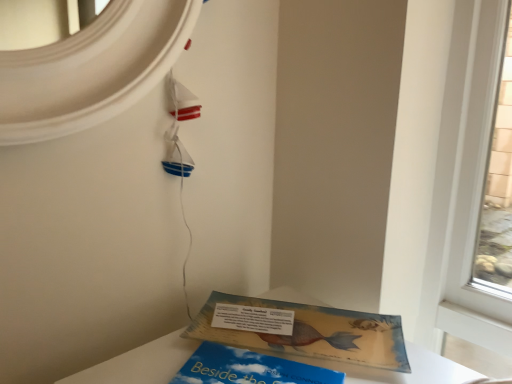
Question: Is blue matte book at lower center, marked as the 1th book in a front-to-back arrangement, at the left side of white paper at lower center?

Choices:
 (A) no
 (B) yes

Answer: (B)

Question: Is blue matte book at lower center, acting as the 2th book starting from the back, further to camera compared to white paper at lower center?

Choices:
 (A) no
 (B) yes

Answer: (A)

Question: From a real-world perspective, is blue matte book at lower center, marked as the 1th book in a front-to-back arrangement, below white paper at lower center?

Choices:
 (A) no
 (B) yes

Answer: (B)

Question: Is blue matte book at lower center, marked as the 1th book in a front-to-back arrangement, positioned in front of white paper at lower center?

Choices:
 (A) no
 (B) yes

Answer: (B)

Question: Is blue matte book at lower center, acting as the 2th book starting from the back, thinner than white paper at lower center?

Choices:
 (A) yes
 (B) no

Answer: (B)

Question: Is point (256, 317) closer or farther from the camera than point (232, 355)?

Choices:
 (A) closer
 (B) farther

Answer: (B)

Question: Is white paper at lower center situated inside blue matte book at lower center, marked as the 1th book in a front-to-back arrangement, or outside?

Choices:
 (A) outside
 (B) inside

Answer: (A)

Question: From the image's perspective, relative to blue matte book at lower center, marked as the 1th book in a front-to-back arrangement, is white paper at lower center above or below?

Choices:
 (A) below
 (B) above

Answer: (B)

Question: Visually, is white paper at lower center positioned to the left or to the right of blue matte book at lower center, acting as the 2th book starting from the back?

Choices:
 (A) right
 (B) left

Answer: (A)

Question: From a real-world perspective, is matte yellow book at lower center, the second book viewed from the front, physically located above or below blue matte book at lower center, marked as the 1th book in a front-to-back arrangement?

Choices:
 (A) above
 (B) below

Answer: (A)

Question: Considering the positions of point (198, 317) and point (214, 374), is point (198, 317) closer or farther from the camera than point (214, 374)?

Choices:
 (A) farther
 (B) closer

Answer: (A)

Question: Is matte yellow book at lower center, the second book viewed from the front, inside or outside of blue matte book at lower center, marked as the 1th book in a front-to-back arrangement?

Choices:
 (A) inside
 (B) outside

Answer: (B)

Question: Looking at the image, does matte yellow book at lower center, which appears as the 1th book when viewed from the back, seem bigger or smaller compared to blue matte book at lower center, marked as the 1th book in a front-to-back arrangement?

Choices:
 (A) big
 (B) small

Answer: (A)

Question: Does point (289, 370) appear closer or farther from the camera than point (309, 339)?

Choices:
 (A) farther
 (B) closer

Answer: (B)

Question: Is blue matte book at lower center, marked as the 1th book in a front-to-back arrangement, taller or shorter than matte yellow book at lower center, which appears as the 1th book when viewed from the back?

Choices:
 (A) short
 (B) tall

Answer: (A)